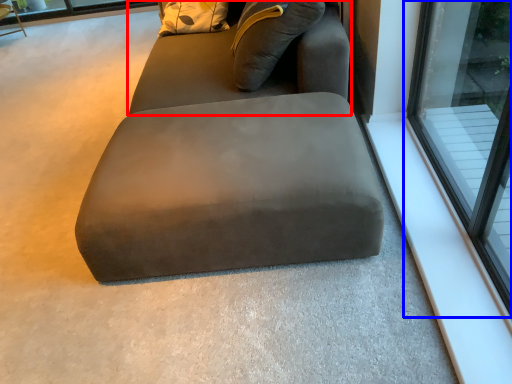
Question: Which point is further to the camera, bean bag chair (highlighted by a red box) or window (highlighted by a blue box)?

Choices:
 (A) bean bag chair
 (B) window

Answer: (A)